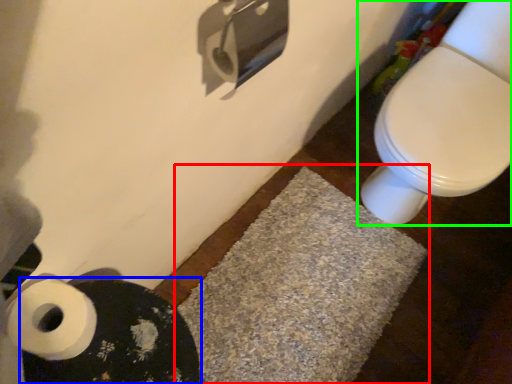
Question: Considering the real-world distances, which object is farthest from bath mat (highlighted by a red box)? bath mat (highlighted by a blue box) or toilet (highlighted by a green box)?

Choices:
 (A) bath mat
 (B) toilet

Answer: (A)